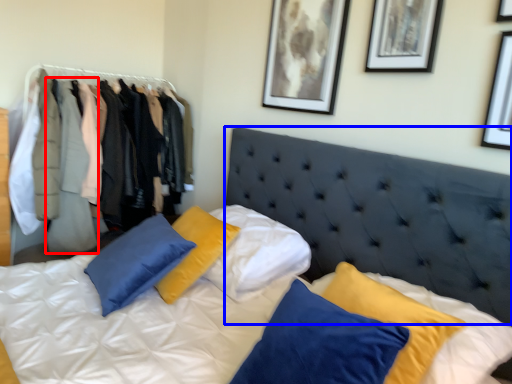
Question: Which of the following is the farthest to the observer, clothing (highlighted by a red box) or headboard (highlighted by a blue box)?

Choices:
 (A) clothing
 (B) headboard

Answer: (A)